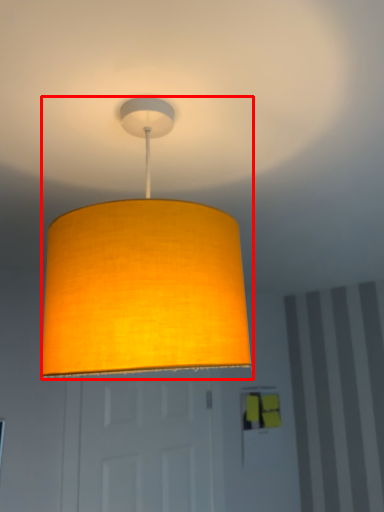
Question: From the image's perspective, where is lamp (annotated by the red box) located in relation to door in the image?

Choices:
 (A) above
 (B) below

Answer: (A)